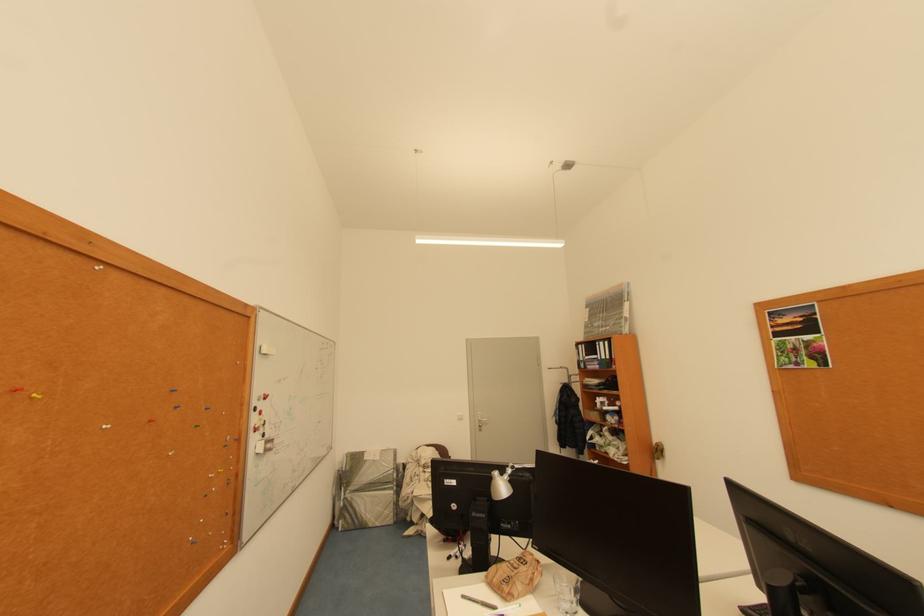
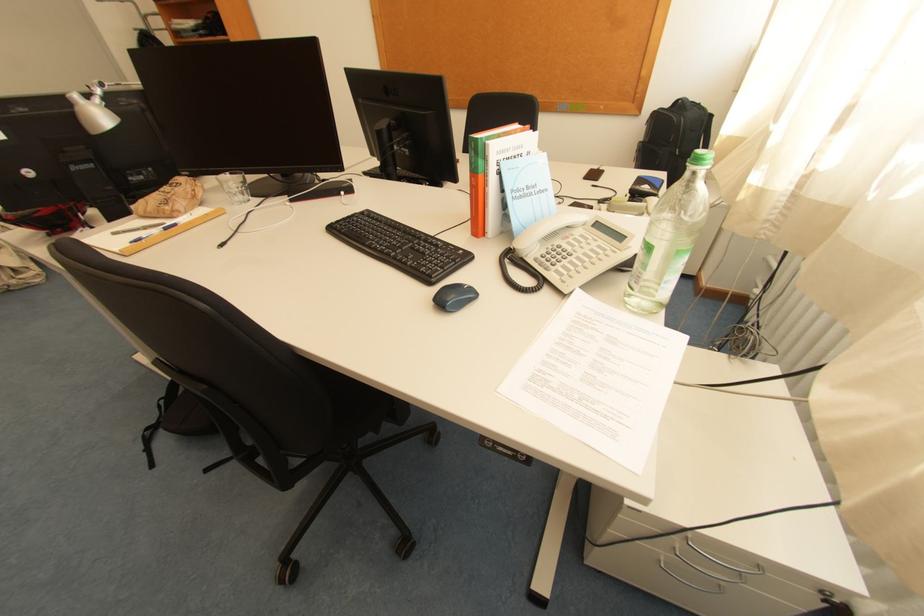
Where in the second image is the point corresponding to the point at 499,586 from the first image?

(155, 217)